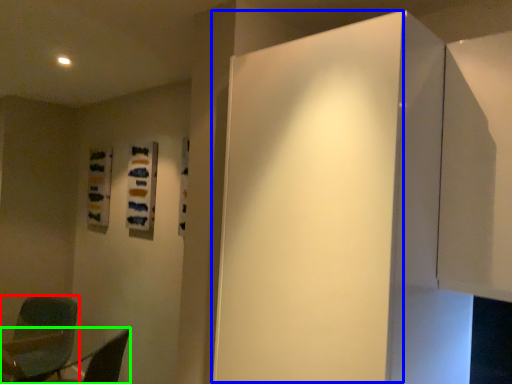
Question: Which object is positioned farthest from chair (highlighted by a red box)? Select from door (highlighted by a blue box) and furniture (highlighted by a green box).

Choices:
 (A) door
 (B) furniture

Answer: (A)